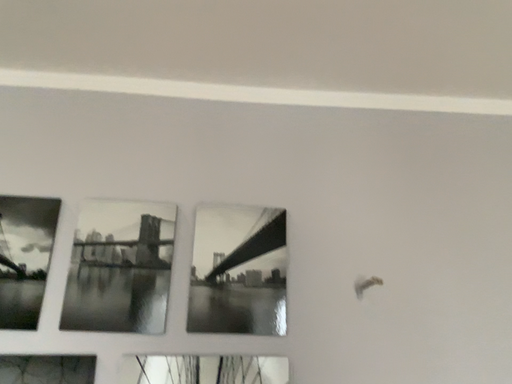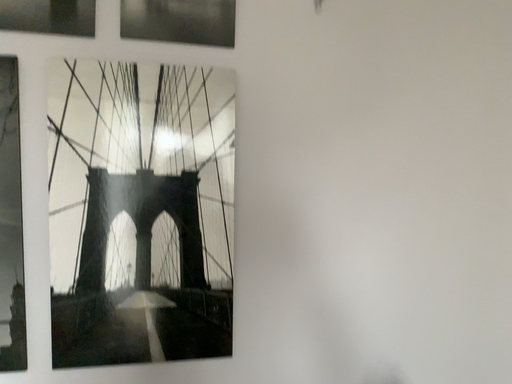
Question: Which way did the camera rotate in the video?

Choices:
 (A) rotated downward
 (B) rotated upward

Answer: (A)